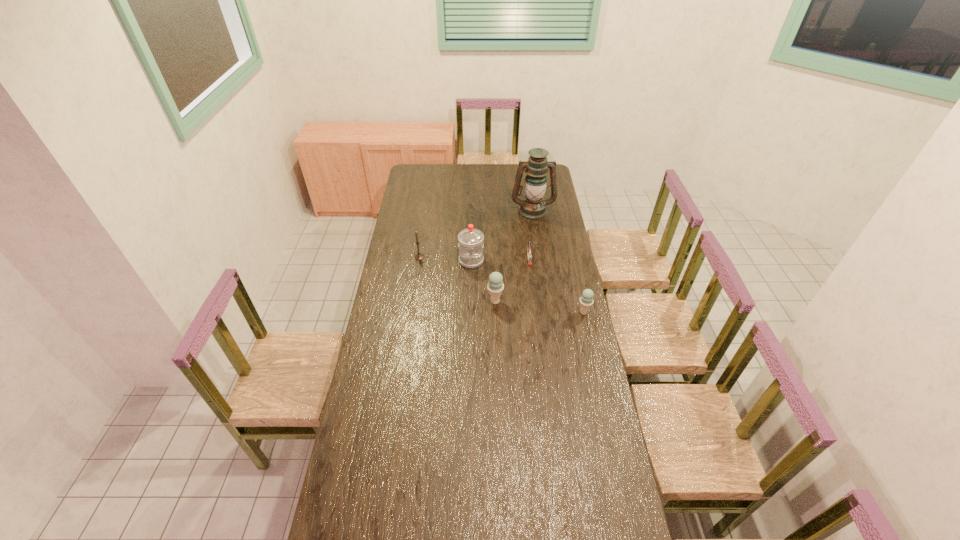
The height and width of the screenshot is (540, 960). In the image, there is a desktop. Identify the location of vacant region at the left edge. (390, 384).

What are the coordinates of `free space at the right edge` in the screenshot? It's located at (557, 250).

Locate an element on the screen. free space between the farthest object and the fourth object from right to left is located at coordinates (514, 256).

The height and width of the screenshot is (540, 960). In order to click on free spot between the second tallest object and the candle in this screenshot , I will do `click(445, 259)`.

Where is `free space between the candle and the second nearest object`? This screenshot has height=540, width=960. free space between the candle and the second nearest object is located at coordinates [457, 279].

At what (x,y) coordinates should I click in order to perform the action: click on vacant point located between the oil lamp and the second object from left to right. Please return your answer as a coordinate pair (x, y). The image size is (960, 540). Looking at the image, I should click on (502, 236).

You are a GUI agent. You are given a task and a screenshot of the screen. Output one action in this format:
    pyautogui.click(x=<x>, y=<y>)
    Task: Click on the free space between the third object from left to right and the candle
    This screenshot has width=960, height=540.
    Given the screenshot: What is the action you would take?
    pyautogui.click(x=457, y=279)

At what (x,y) coordinates should I click in order to perform the action: click on free space that is in between the nearest object and the water bottle. Please return your answer as a coordinate pair (x, y). Looking at the image, I should click on (528, 287).

This screenshot has width=960, height=540. I want to click on empty location between the oil lamp and the taller ice cream, so click(514, 256).

Find the location of a particular element. vacant area between the rightmost object and the shortest object is located at coordinates (557, 286).